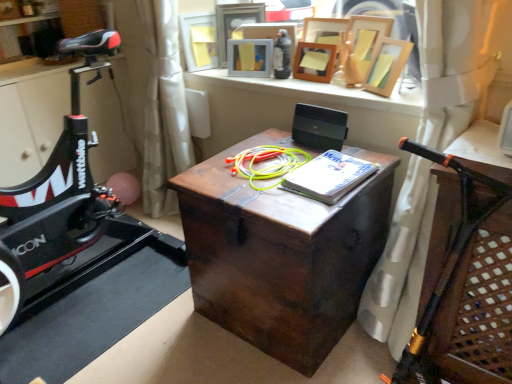
The height and width of the screenshot is (384, 512). I want to click on blank space situated above dark wood trunk at center (from a real-world perspective), so click(x=271, y=163).